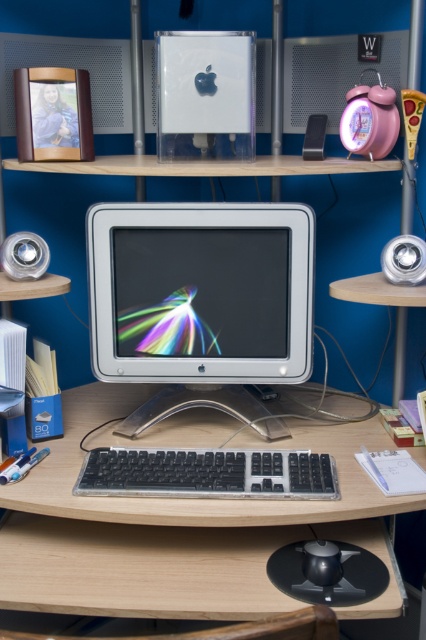
You are setting up a new monitor and need to place it above the clear wood computer desk at center. Is there enough vertical space between the desk and the satin silver monitor at center to fit a 10 cm thick laptop?

The clear wood computer desk at center is located below the satin silver monitor at center, meaning there is space between them. Since the vertical distance isn let in the description, we cannot confirm if it can fit a 10 cm thick laptop.

You are setting up a new speaker system in the computer workstation shown. You have a metallic silver speaker at upper center and a wooden table at right. Which object is taller?

The wooden table at right is taller than the metallic silver speaker at upper center according to the description.

You are standing at point (195, 548) and want to reach the iMac G3 on the desk. The distance between you and the iMac G3 is 3.83 feet. If you can move in a straight line, how many steps would it take you to reach the iMac G3? Assume each step covers 2.5 feet.

The distance between you and the iMac G3 is 3.83 feet. Since each step covers 2.5 feet, you would need approximately 2 steps to reach the iMac G3. The first step would cover 2.5 feet, and the remaining 1.33 feet would be covered in the second step.